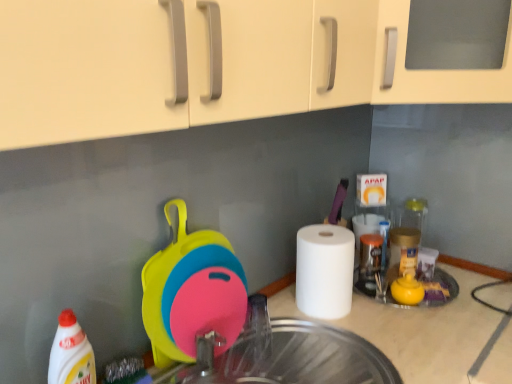
Question: Considering the relative sizes of transparent glass sink at center and white glossy bottle at lower left in the image provided, is transparent glass sink at center bigger than white glossy bottle at lower left?

Choices:
 (A) yes
 (B) no

Answer: (A)

Question: Is transparent glass sink at center facing towards white glossy bottle at lower left?

Choices:
 (A) yes
 (B) no

Answer: (B)

Question: Would you say transparent glass sink at center is a long distance from white glossy bottle at lower left?

Choices:
 (A) yes
 (B) no

Answer: (B)

Question: Does transparent glass sink at center have a smaller size compared to white glossy bottle at lower left?

Choices:
 (A) no
 (B) yes

Answer: (A)

Question: Is white glossy bottle at lower left surrounded by transparent glass sink at center?

Choices:
 (A) yes
 (B) no

Answer: (B)

Question: Is transparent glass sink at center closer to the viewer compared to white glossy bottle at lower left?

Choices:
 (A) yes
 (B) no

Answer: (A)

Question: Does white glossy bottle at lower left have a greater height compared to metallic silver faucet at center?

Choices:
 (A) no
 (B) yes

Answer: (B)

Question: Considering the relative positions of white glossy bottle at lower left and metallic silver faucet at center in the image provided, is white glossy bottle at lower left to the left of metallic silver faucet at center from the viewer's perspective?

Choices:
 (A) yes
 (B) no

Answer: (A)

Question: Considering the relative sizes of white glossy bottle at lower left and metallic silver faucet at center in the image provided, is white glossy bottle at lower left thinner than metallic silver faucet at center?

Choices:
 (A) yes
 (B) no

Answer: (A)

Question: Is white glossy bottle at lower left oriented away from metallic silver faucet at center?

Choices:
 (A) no
 (B) yes

Answer: (A)

Question: Could metallic silver faucet at center be considered to be inside white glossy bottle at lower left?

Choices:
 (A) no
 (B) yes

Answer: (A)

Question: Is white glossy bottle at lower left further to the viewer compared to metallic silver faucet at center?

Choices:
 (A) no
 (B) yes

Answer: (A)

Question: Is white matte paper towel at right far away from transparent glass sink at center?

Choices:
 (A) no
 (B) yes

Answer: (A)